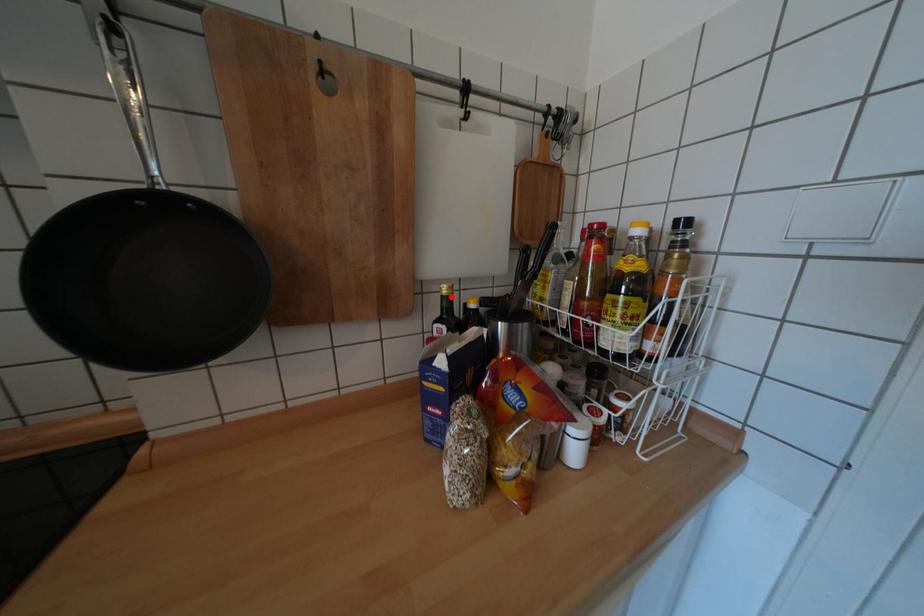
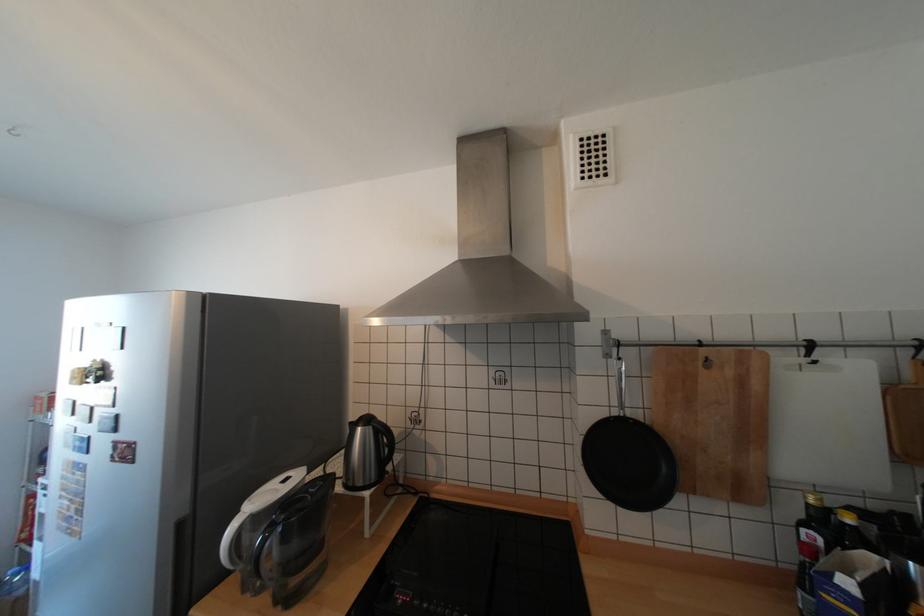
In the second image, find the point that corresponds to the highlighted location in the first image.

(817, 505)